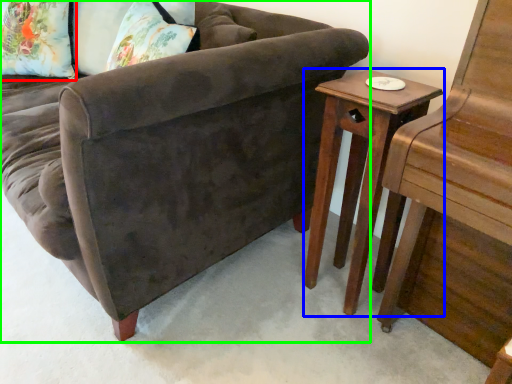
Question: Which object is the farthest from pillow (highlighted by a red box)? Choose among these: table (highlighted by a blue box) or studio couch (highlighted by a green box).

Choices:
 (A) table
 (B) studio couch

Answer: (A)